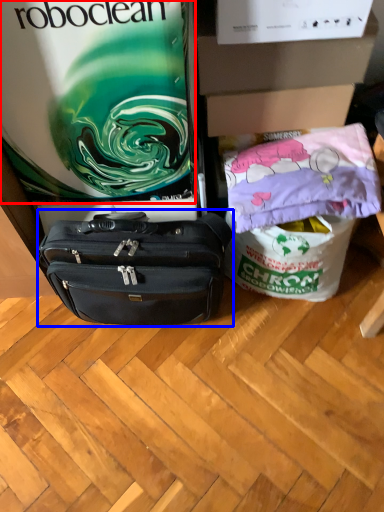
Question: Among these objects, which one is farthest to the camera, gift bag (highlighted by a red box) or luggage and bags (highlighted by a blue box)?

Choices:
 (A) gift bag
 (B) luggage and bags

Answer: (B)